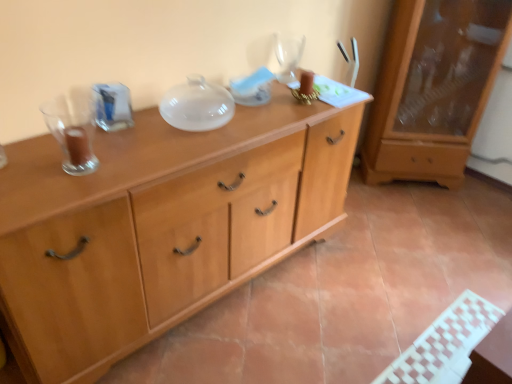
What do you see at coordinates (158, 227) in the screenshot? I see `light wood cabinet at center` at bounding box center [158, 227].

Image resolution: width=512 pixels, height=384 pixels. What are the coordinates of `matte wooden cabinet at right` in the screenshot? It's located at (434, 88).

Considering the relative sizes of matte wooden cabinet at right and transparent glass wine glass at upper center in the image provided, is matte wooden cabinet at right thinner than transparent glass wine glass at upper center?

In fact, matte wooden cabinet at right might be wider than transparent glass wine glass at upper center.

Could you tell me if matte wooden cabinet at right is facing transparent glass wine glass at upper center?

No.

From the image's perspective, which one is positioned higher, matte wooden cabinet at right or transparent glass wine glass at upper center?

transparent glass wine glass at upper center appears higher in the image.

In order to click on wine glass positioned vertically above the matte wooden cabinet at right (from a real-world perspective) in this screenshot , I will do `click(288, 55)`.

In terms of width, does light wood cabinet at center look wider or thinner when compared to transparent glass wine glass at upper center?

Considering their sizes, light wood cabinet at center looks broader than transparent glass wine glass at upper center.

Is point (309, 123) closer to viewer compared to point (281, 53)?

Yes, point (309, 123) is in front of point (281, 53).

Consider the image. Can you confirm if light wood cabinet at center is shorter than transparent glass wine glass at upper center?

Incorrect, the height of light wood cabinet at center does not fall short of that of transparent glass wine glass at upper center.

Is the surface of light wood cabinet at center in direct contact with matte wooden cabinet at right?

No, light wood cabinet at center is not making contact with matte wooden cabinet at right.

From the image's perspective, does light wood cabinet at center appear lower than matte wooden cabinet at right?

Indeed, from the image's perspective, light wood cabinet at center is shown beneath matte wooden cabinet at right.

From a real-world perspective, is light wood cabinet at center beneath matte wooden cabinet at right?

Yes.

Is light wood cabinet at center not inside matte wooden cabinet at right?

Yes, light wood cabinet at center is not within matte wooden cabinet at right.

From a real-world perspective, is transparent glass wine glass at upper center above or below light wood cabinet at center?

transparent glass wine glass at upper center is situated higher than light wood cabinet at center in the real world.

Is transparent glass wine glass at upper center behind light wood cabinet at center?

That is True.

Image resolution: width=512 pixels, height=384 pixels. I want to click on wine glass that appears above the light wood cabinet at center (from a real-world perspective), so click(288, 55).

Is matte wooden cabinet at right turned away from light wood cabinet at center?

No, matte wooden cabinet at right is not facing the opposite direction of light wood cabinet at center.

Considering the sizes of objects matte wooden cabinet at right and light wood cabinet at center in the image provided, who is smaller, matte wooden cabinet at right or light wood cabinet at center?

matte wooden cabinet at right.

Find the location of a particular element. This screenshot has width=512, height=384. the chest of drawers located below the matte wooden cabinet at right (from the image's perspective) is located at coordinates (158, 227).

Is matte wooden cabinet at right beside light wood cabinet at center?

matte wooden cabinet at right and light wood cabinet at center are not in contact.

Considering the relative sizes of transparent glass wine glass at upper center and matte wooden cabinet at right in the image provided, is transparent glass wine glass at upper center thinner than matte wooden cabinet at right?

Yes, transparent glass wine glass at upper center is thinner than matte wooden cabinet at right.

Is there a large distance between transparent glass wine glass at upper center and matte wooden cabinet at right?

No, there isn't a large distance between transparent glass wine glass at upper center and matte wooden cabinet at right.

Is transparent glass wine glass at upper center facing towards matte wooden cabinet at right?

A: No, transparent glass wine glass at upper center is not facing towards matte wooden cabinet at right.

Based on their positions, is transparent glass wine glass at upper center located to the left or right of matte wooden cabinet at right?

transparent glass wine glass at upper center is positioned on matte wooden cabinet at right's left side.

Identify the location of wine glass on the left of matte wooden cabinet at right. (288, 55).

I want to click on wine glass lying behind the light wood cabinet at center, so click(x=288, y=55).

In the scene shown: Based on their spatial positions, is light wood cabinet at center or transparent glass wine glass at upper center closer to matte wooden cabinet at right?

Based on the image, transparent glass wine glass at upper center appears to be nearer to matte wooden cabinet at right.

Considering their positions, is transparent glass wine glass at upper center positioned further to matte wooden cabinet at right than light wood cabinet at center?

light wood cabinet at center lies further to matte wooden cabinet at right than the other object.

From the image, which object appears to be farther from transparent glass wine glass at upper center, matte wooden cabinet at right or light wood cabinet at center?

Among the two, matte wooden cabinet at right is located further to transparent glass wine glass at upper center.

From the image, which object appears to be nearer to light wood cabinet at center, transparent glass wine glass at upper center or matte wooden cabinet at right?

Among the two, transparent glass wine glass at upper center is located nearer to light wood cabinet at center.

From the image, which object appears to be nearer to transparent glass wine glass at upper center, light wood cabinet at center or matte wooden cabinet at right?

light wood cabinet at center lies closer to transparent glass wine glass at upper center than the other object.

Looking at the image, which one is located further to light wood cabinet at center, matte wooden cabinet at right or transparent glass wine glass at upper center?

matte wooden cabinet at right.

Find the location of a particular element. The width and height of the screenshot is (512, 384). wine glass between light wood cabinet at center and matte wooden cabinet at right from left to right is located at coordinates (288, 55).